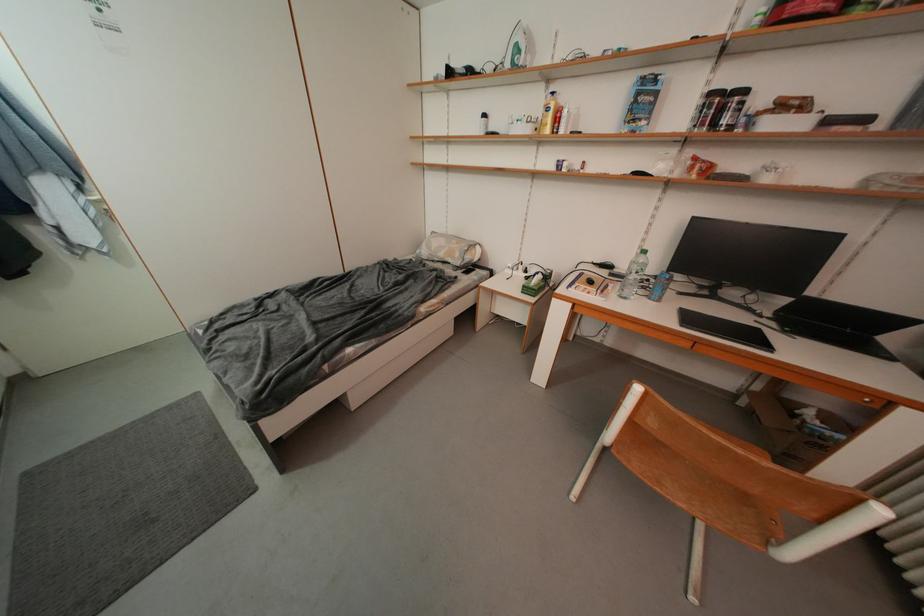
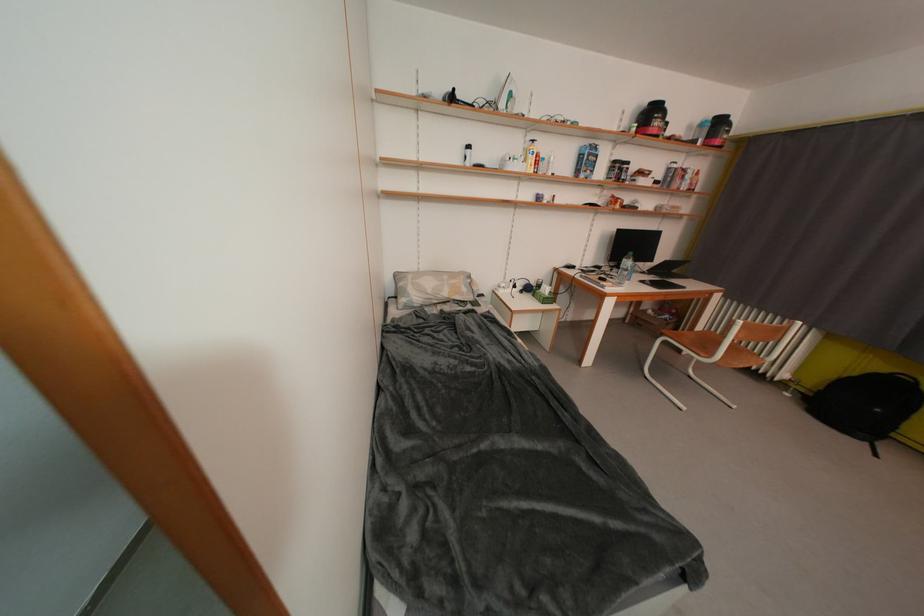
The point at (457,76) is marked in the first image. Where is the corresponding point in the second image?

(459, 100)